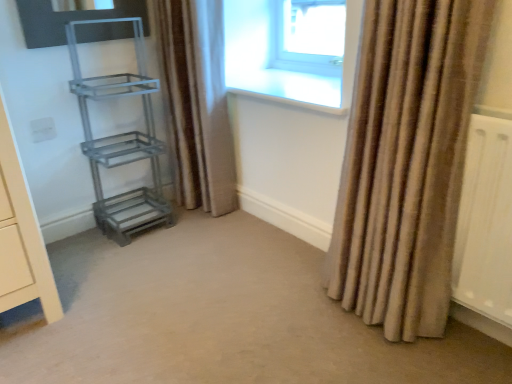
This screenshot has height=384, width=512. Find the location of `vacant area in front of beige textured curtain at right, which appears as the 2th curtain when viewed from the left`. vacant area in front of beige textured curtain at right, which appears as the 2th curtain when viewed from the left is located at coordinates (406, 359).